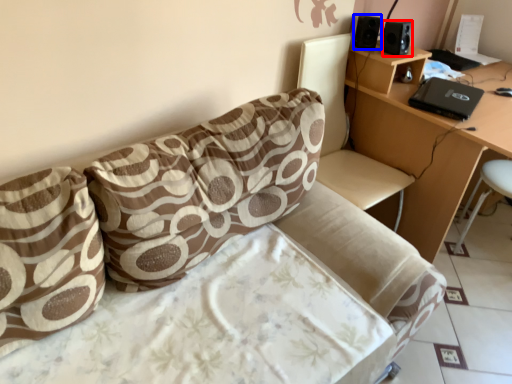
Question: Which of the following is the closest to the observer, speaker (highlighted by a red box) or speaker (highlighted by a blue box)?

Choices:
 (A) speaker
 (B) speaker

Answer: (A)